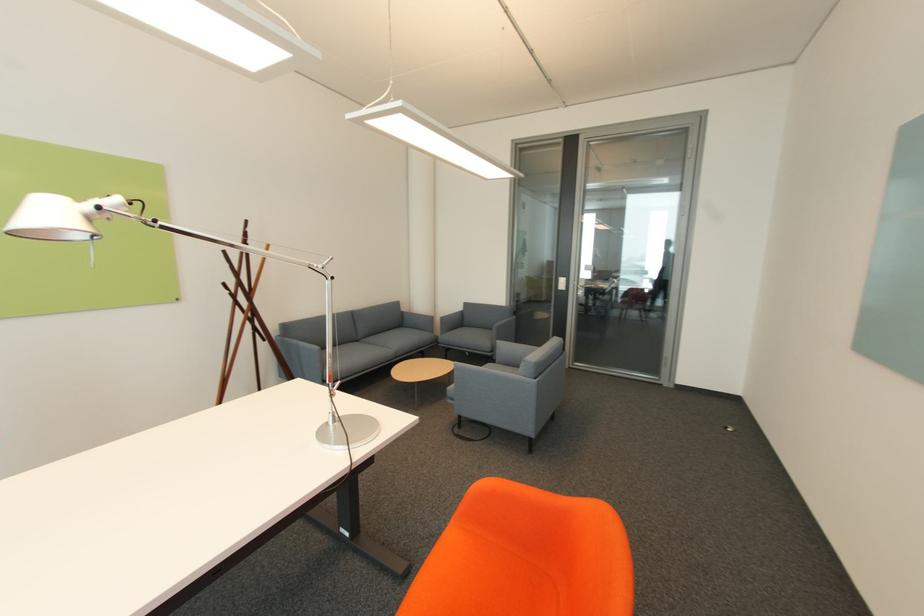
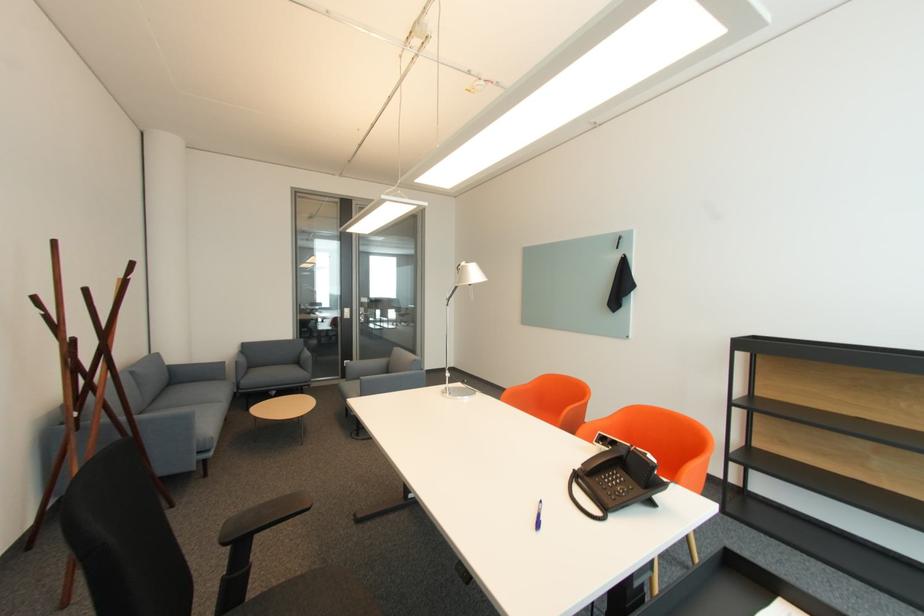
In the second image, find the point that corresponds to point (490, 329) in the first image.

(282, 365)